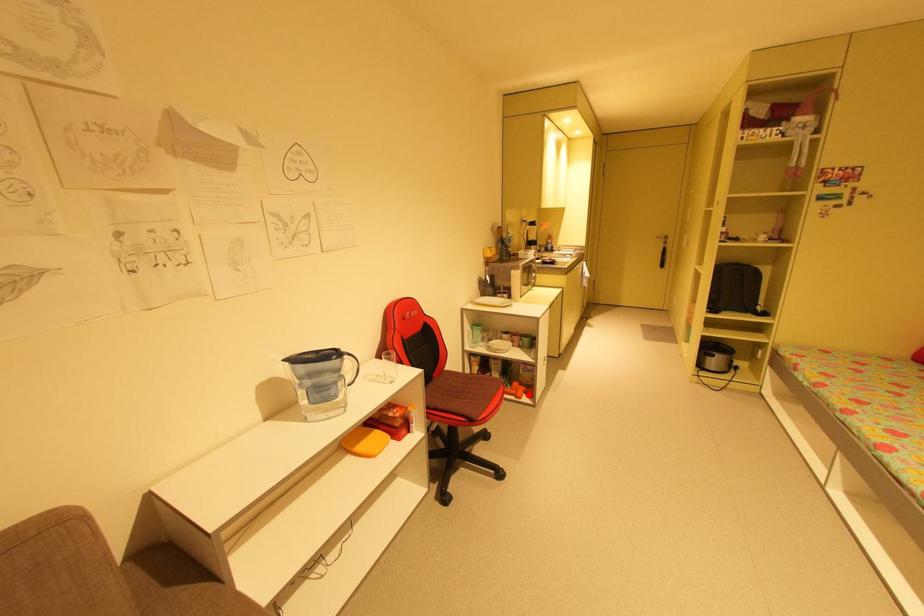
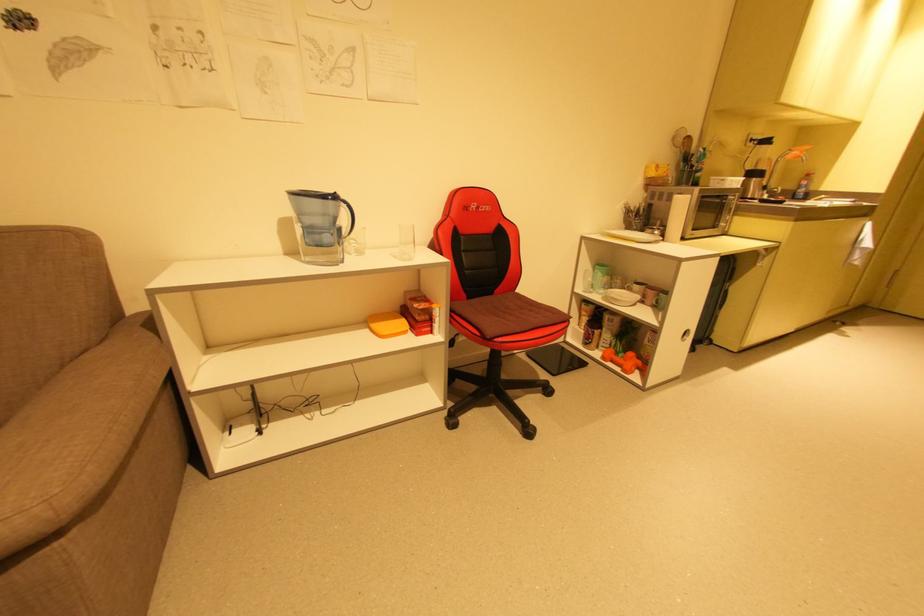
Find the pixel in the second image that matches the highlighted location in the first image.

(641, 371)